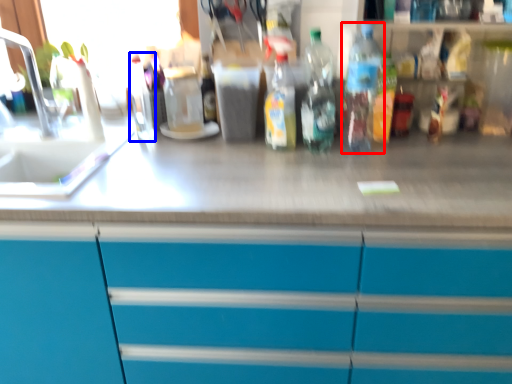
Question: Among these objects, which one is nearest to the camera, bottle (highlighted by a red box) or bottle (highlighted by a blue box)?

Choices:
 (A) bottle
 (B) bottle

Answer: (A)